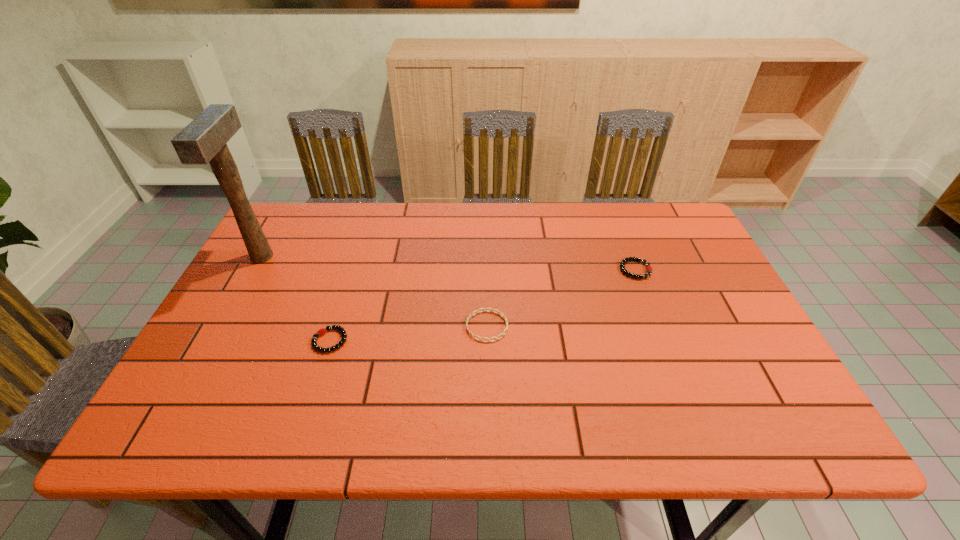
Where is `vacant space situated on the surface of the third object from left to right showing star-shaped elements`? The height and width of the screenshot is (540, 960). vacant space situated on the surface of the third object from left to right showing star-shaped elements is located at coordinates (320, 326).

Locate an element on the screen. free location located on the right of the second object from left to right is located at coordinates (440, 341).

You are a GUI agent. You are given a task and a screenshot of the screen. Output one action in this format:
    pyautogui.click(x=<x>, y=<y>)
    Task: Click on the object that is at the far edge
    This screenshot has height=540, width=960.
    Given the screenshot: What is the action you would take?
    pyautogui.click(x=203, y=140)

At what (x,y) coordinates should I click in order to perform the action: click on object located in the left edge section of the desktop. Please return your answer as a coordinate pair (x, y). Looking at the image, I should click on (203, 140).

At what (x,y) coordinates should I click in order to perform the action: click on object present at the far left corner. Please return your answer as a coordinate pair (x, y). This screenshot has height=540, width=960. Looking at the image, I should click on (203, 140).

Where is `free space at the far edge`? free space at the far edge is located at coordinates (351, 215).

Where is `blank space at the near edge of the desktop`? This screenshot has width=960, height=540. blank space at the near edge of the desktop is located at coordinates (673, 413).

The image size is (960, 540). In the image, there is a desktop. Find the location of `vacant space at the right edge`. vacant space at the right edge is located at coordinates (756, 395).

Locate an element on the screen. free point at the near left corner is located at coordinates (227, 431).

I want to click on vacant region between the rightmost bracelet and the second bracelet from left to right, so click(562, 298).